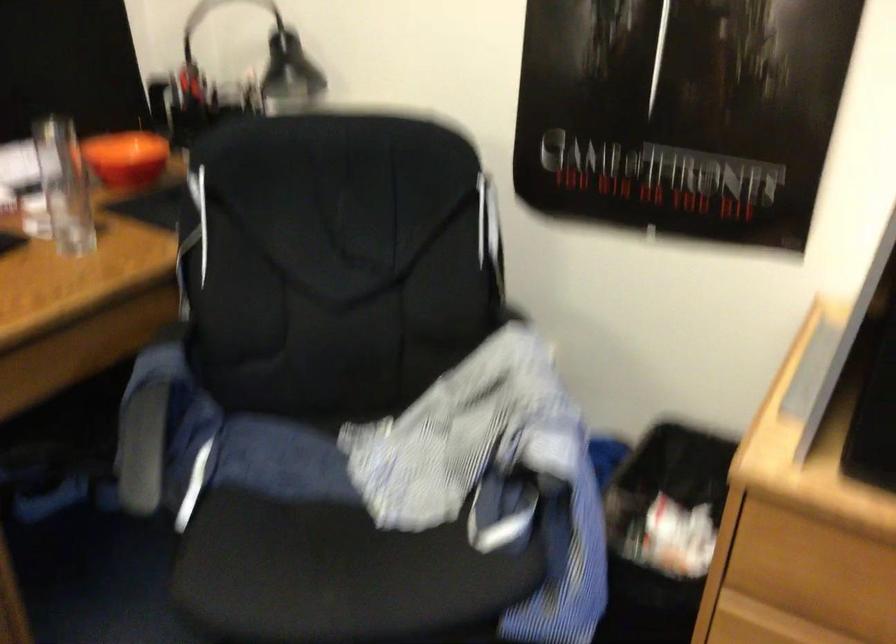
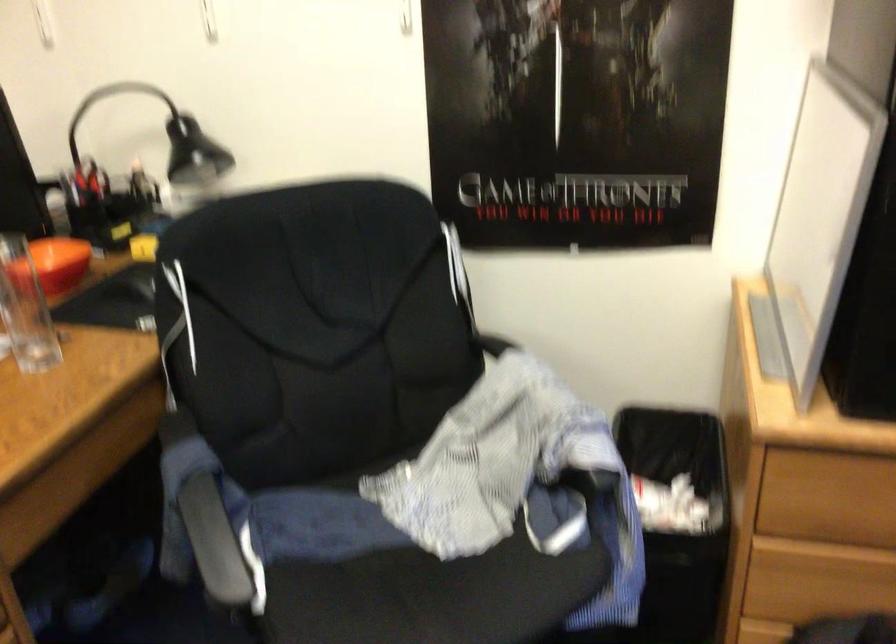
Question: The first image is from the beginning of the video and the second image is from the end. How did the camera likely rotate when shooting the video?

Choices:
 (A) Left
 (B) Right
 (C) Up
 (D) Down

Answer: (B)